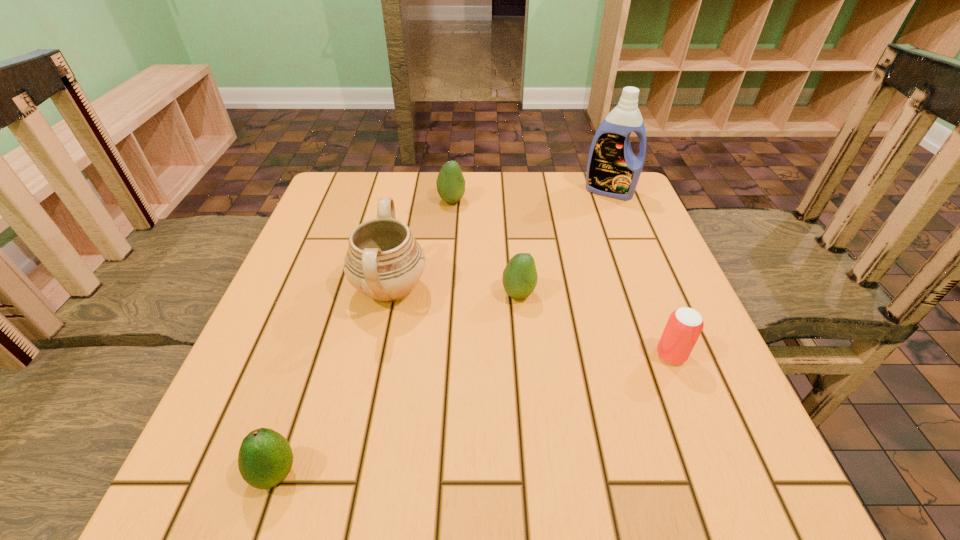
Where is `free space located 0.250m on the left of the second avocado from right to left`? free space located 0.250m on the left of the second avocado from right to left is located at coordinates (341, 201).

Locate an element on the screen. Image resolution: width=960 pixels, height=540 pixels. free space located 0.300m on the back of the second nearest avocado is located at coordinates (510, 202).

The width and height of the screenshot is (960, 540). Identify the location of vacant space located on the front of the beer can. (701, 433).

I want to click on free space located 0.080m on the left of the nearest avocado, so click(196, 473).

You are a GUI agent. You are given a task and a screenshot of the screen. Output one action in this format:
    pyautogui.click(x=<x>, y=<y>)
    Task: Click on the detergent that is positioned at the far edge
    
    Given the screenshot: What is the action you would take?
    pyautogui.click(x=613, y=170)

You are a GUI agent. You are given a task and a screenshot of the screen. Output one action in this format:
    pyautogui.click(x=<x>, y=<y>)
    Task: Click on the avocado present at the far edge
    The width and height of the screenshot is (960, 540).
    Given the screenshot: What is the action you would take?
    point(450,182)

What are the coordinates of `object located at the near edge` in the screenshot? It's located at (265, 458).

This screenshot has width=960, height=540. In order to click on urn located at the left edge in this screenshot , I will do `click(383, 261)`.

Find the location of a particular element. This screenshot has height=540, width=960. avocado at the left edge is located at coordinates (265, 458).

You are a GUI agent. You are given a task and a screenshot of the screen. Output one action in this format:
    pyautogui.click(x=<x>, y=<y>)
    Task: Click on the detergent at the right edge
    The width and height of the screenshot is (960, 540).
    Given the screenshot: What is the action you would take?
    pyautogui.click(x=613, y=170)